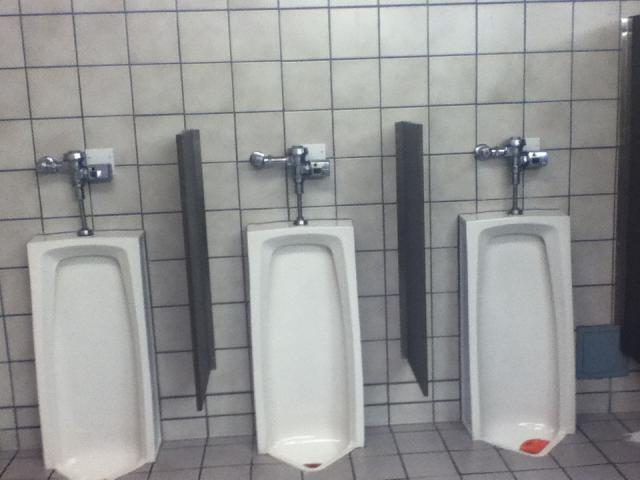
This screenshot has height=480, width=640. I want to click on top of the urinal, so click(132, 237).